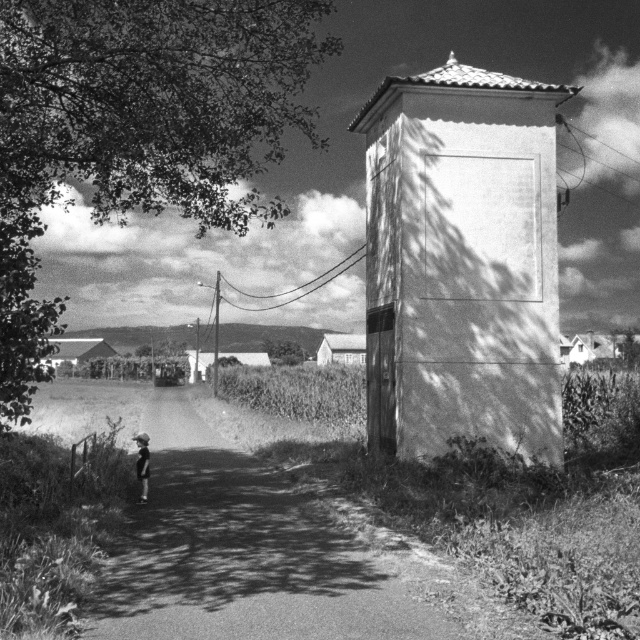
In the scene shown: You are a photographer trying to capture a photo of the smooth concrete water tower at center and the light skin tone human at center. Based on their sizes, which one will appear larger in the photo?

The smooth concrete water tower at center is taller than the light skin tone human at center, so it will appear larger in the photo.

You are standing at the point marked by the coordinates point (x=138, y=129). Looking around, you see a dark green leafy tree at upper left. What is the nearest object to you?

The nearest object to you is the dark green leafy tree at upper left marked by the point (x=138, y=129).